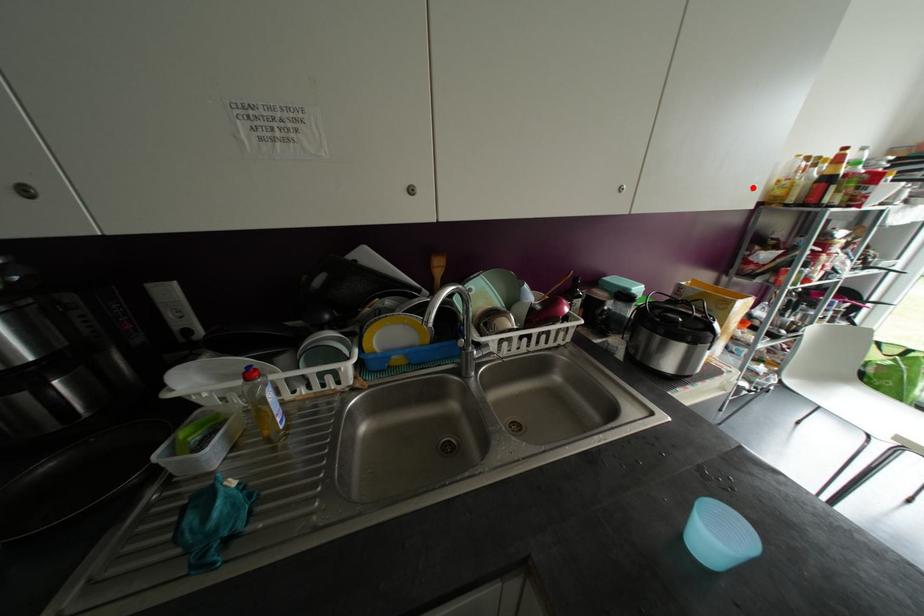
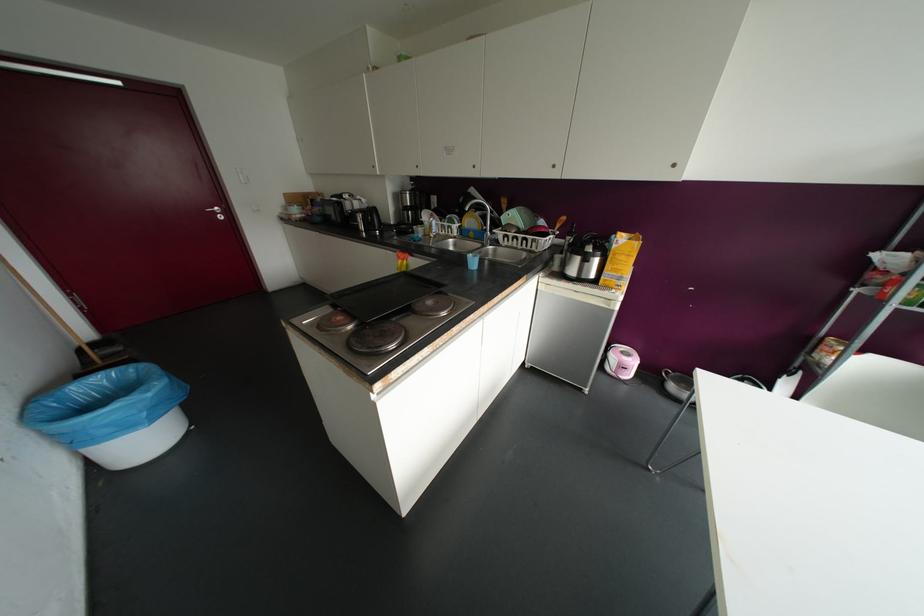
The point at the highlighted location is marked in the first image. Where is the corresponding point in the second image?

(673, 164)